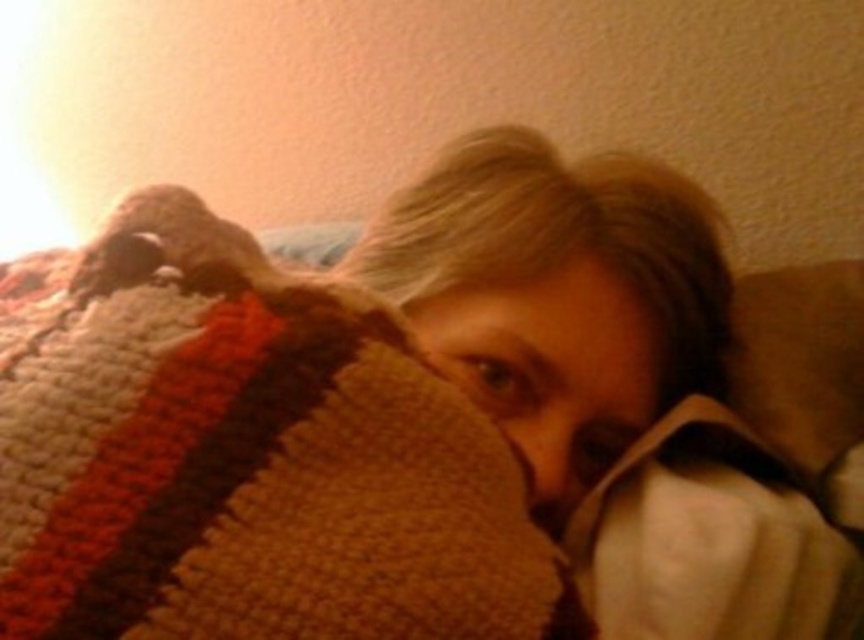
You are positioning a small nightlight in the corner of the room. The knitted wool blanket at center is placed at coordinates 0.717 on the x and 0.288 on the y. Will the nightlight placed at the bottom right corner interfere with the blanket?

The knitted wool blanket at center is located at point (248, 458), so placing the nightlight at the bottom right corner would not interfere with the blanket as they are in different areas of the room.